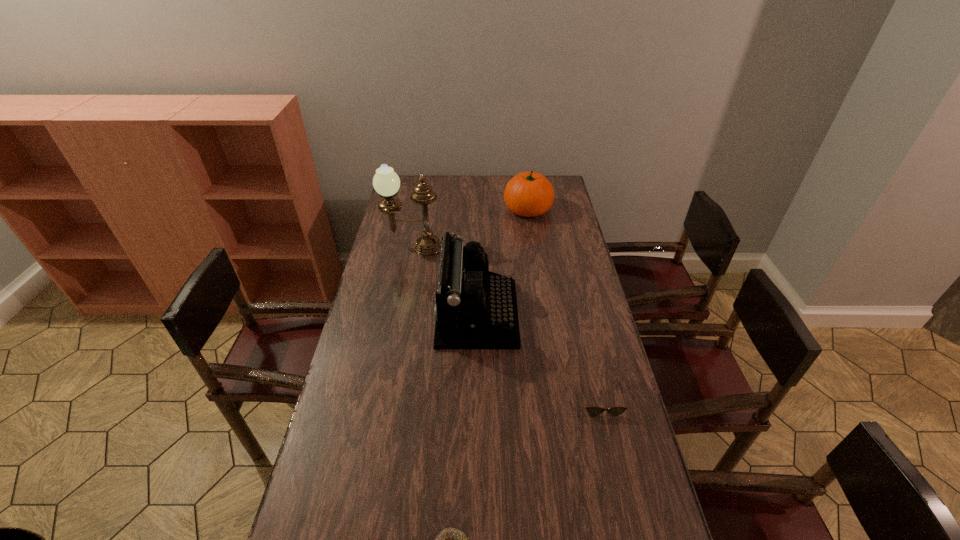
Where is `the second farthest object`? The image size is (960, 540). the second farthest object is located at coordinates (386, 182).

Find the location of `the tallest object`. the tallest object is located at coordinates (386, 182).

Identify the location of typewriter. (475, 309).

Find the location of a particular element. This screenshot has width=960, height=540. the third farthest object is located at coordinates click(475, 309).

I want to click on the third tallest object, so click(x=528, y=194).

You are a GUI agent. You are given a task and a screenshot of the screen. Output one action in this format:
    pyautogui.click(x=<x>, y=<y>)
    Task: Click on the farthest object
    The width and height of the screenshot is (960, 540).
    Given the screenshot: What is the action you would take?
    pyautogui.click(x=528, y=194)

Identify the location of the fourth tallest object. (592, 411).

This screenshot has width=960, height=540. Find the location of `the second nearest object`. the second nearest object is located at coordinates (592, 411).

Identify the location of free location located on the back of the second farthest object. (422, 198).

Locate an element on the screen. vacant space located 0.220m on the typing side of the third farthest object is located at coordinates (578, 314).